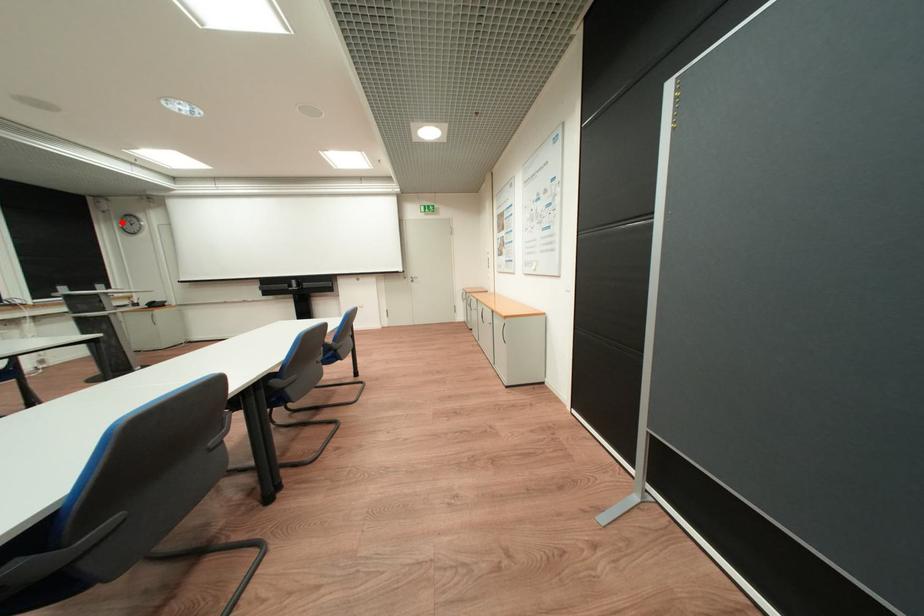
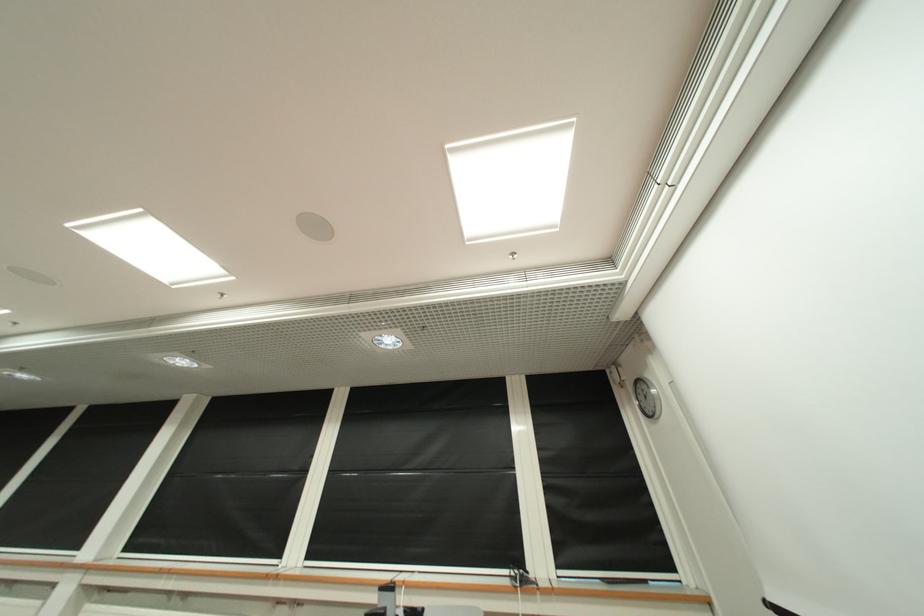
Question: I am providing you with two images of the same scene from different viewpoints. A red point is marked on the first image. Can you still see the location of the red point in image 2?

Choices:
 (A) Yes
 (B) No

Answer: (A)